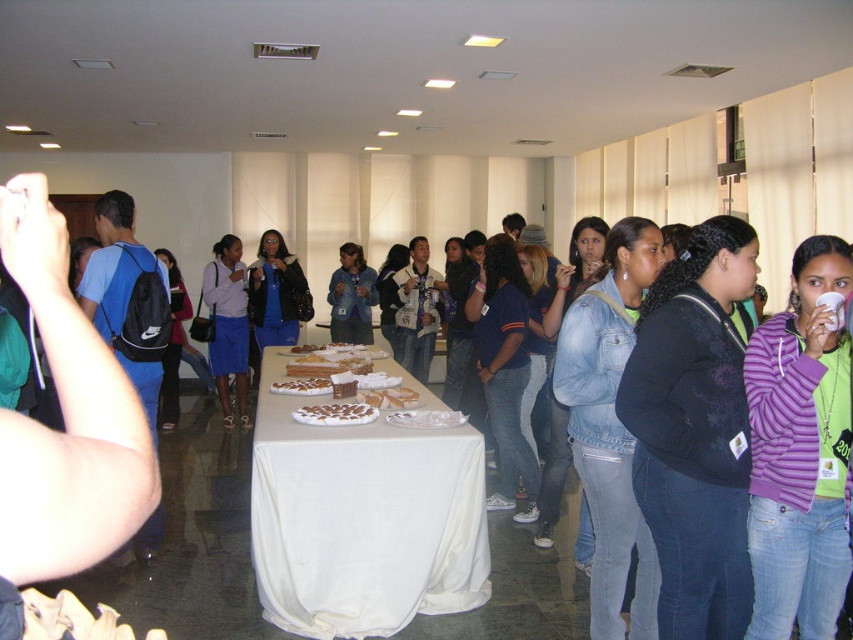
You are at the entrance of the room and see the point marked at coordinates (363,518). What object is located at that point?

The white cloth table at center is located at point (363,518).